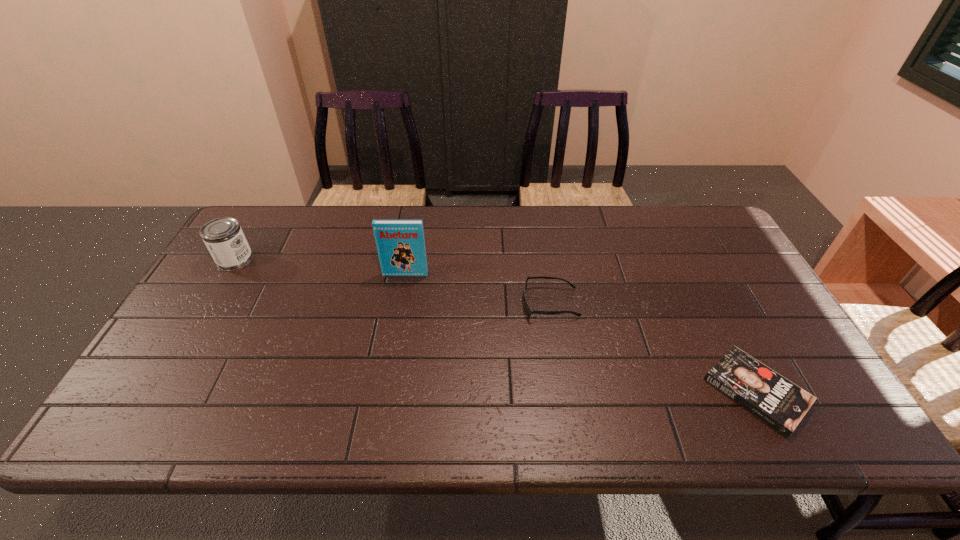
What are the coordinates of `free space between the left book and the sunglasses` in the screenshot? It's located at [x=478, y=288].

Locate an element on the screen. The width and height of the screenshot is (960, 540). free spot between the farthest object and the farther book is located at coordinates tap(321, 267).

Where is `free space between the third object from right to left and the second object from right to left`? free space between the third object from right to left and the second object from right to left is located at coordinates (478, 288).

The height and width of the screenshot is (540, 960). Find the location of `vacant point located between the right book and the second farthest object`. vacant point located between the right book and the second farthest object is located at coordinates (581, 333).

Identify which object is located as the second nearest to the can. Please provide its 2D coordinates. Your answer should be formatted as a tuple, i.e. [(x, y)], where the tuple contains the x and y coordinates of a point satisfying the conditions above.

[(529, 311)]

Locate which object is the closest to the right book. Please provide its 2D coordinates. Your answer should be formatted as a tuple, i.e. [(x, y)], where the tuple contains the x and y coordinates of a point satisfying the conditions above.

[(529, 311)]

Find the location of `blank space that satisfies the following two spatial constraints: 1. on the front-facing side of the shorter book; 2. on the left side of the second object from right to left`. blank space that satisfies the following two spatial constraints: 1. on the front-facing side of the shorter book; 2. on the left side of the second object from right to left is located at coordinates (564, 392).

In order to click on vacant space that satisfies the following two spatial constraints: 1. on the front-facing side of the shorter book; 2. on the right side of the second nearest object in this screenshot , I will do `click(564, 392)`.